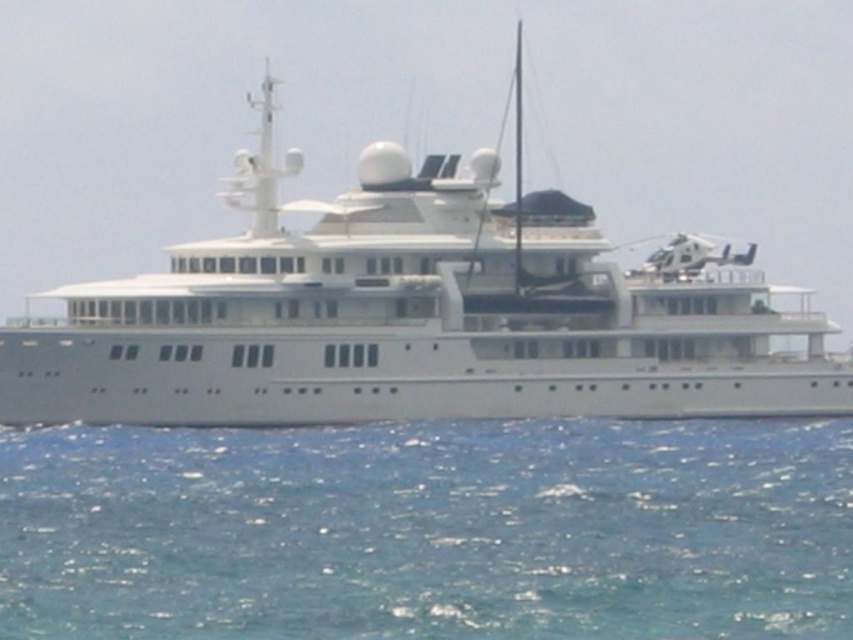
Is blue water at lower center taller than white glossy cruise ship at center?

No, blue water at lower center is not taller than white glossy cruise ship at center.

Who is positioned more to the left, blue water at lower center or white glossy cruise ship at center?

white glossy cruise ship at center

Is point (200, 636) closer to viewer compared to point (262, 92)?

That is True.

You are a GUI agent. You are given a task and a screenshot of the screen. Output one action in this format:
    pyautogui.click(x=<x>, y=<y>)
    Task: Click on the blue water at lower center
    
    Given the screenshot: What is the action you would take?
    pyautogui.click(x=428, y=531)